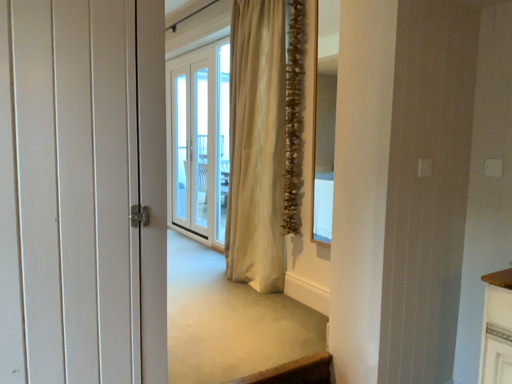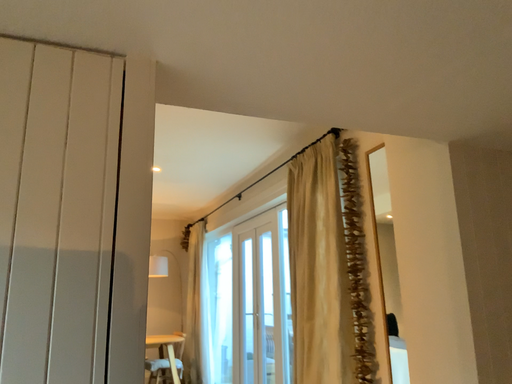
Question: Which way did the camera rotate in the video?

Choices:
 (A) rotated left
 (B) rotated right

Answer: (A)